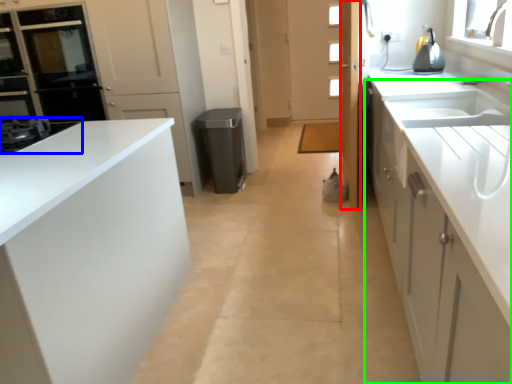
Question: Which is farther away from door (highlighted by a red box)? home appliance (highlighted by a blue box) or cabinetry (highlighted by a green box)?

Choices:
 (A) home appliance
 (B) cabinetry

Answer: (A)